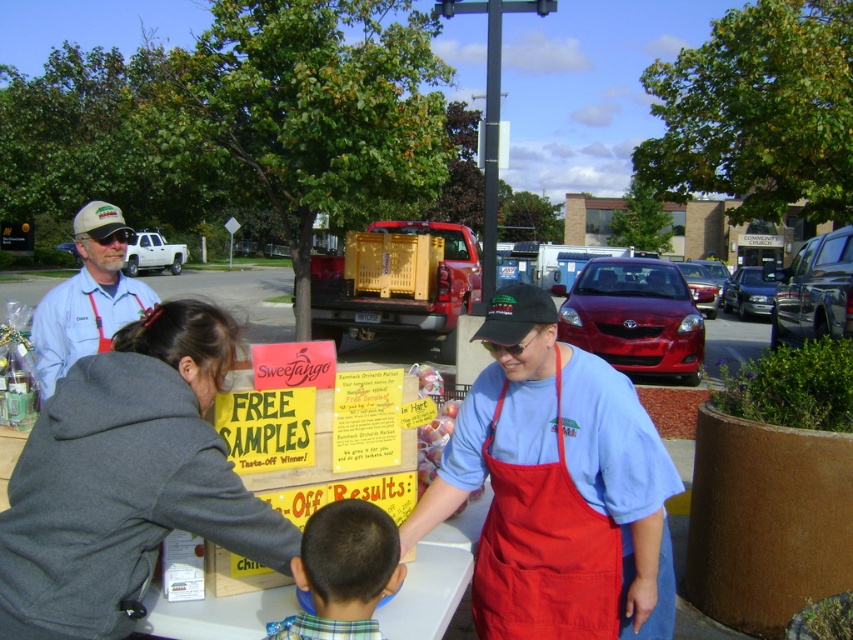
Can you confirm if matte blue shirt at center is smaller than red fabric apron at center?

Actually, matte blue shirt at center might be larger than red fabric apron at center.

Describe the element at coordinates (556, 486) in the screenshot. This screenshot has width=853, height=640. I see `matte blue shirt at center` at that location.

Describe the element at coordinates (556, 486) in the screenshot. This screenshot has width=853, height=640. I see `matte blue shirt at center` at that location.

I want to click on matte blue shirt at center, so click(x=556, y=486).

Does matte blue shirt at center have a smaller size compared to gray fleece sweatshirt at center?

No.

Is matte blue shirt at center shorter than gray fleece sweatshirt at center?

No, matte blue shirt at center is not shorter than gray fleece sweatshirt at center.

Is point (628, 458) closer to viewer compared to point (227, 369)?

No, (628, 458) is further to viewer.

In order to click on matte blue shirt at center in this screenshot , I will do `click(556, 486)`.

Is matte blue shirt at center to the left of plaid shirt at lower center from the viewer's perspective?

No, matte blue shirt at center is not to the left of plaid shirt at lower center.

Can you confirm if matte blue shirt at center is positioned to the right of plaid shirt at lower center?

Indeed, matte blue shirt at center is positioned on the right side of plaid shirt at lower center.

Image resolution: width=853 pixels, height=640 pixels. What are the coordinates of `matte blue shirt at center` in the screenshot? It's located at (556, 486).